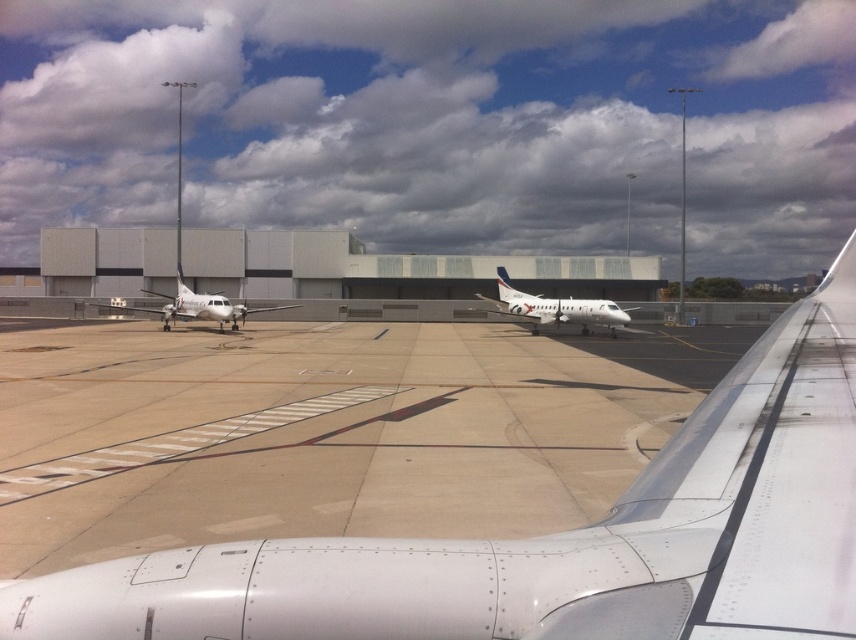
You are a ground crew member observing the two airplanes at the airport. Which airplane, the white metallic airplane at center or the silver metallic airplane at center, is positioned lower on the tarmac?

The white metallic airplane at center is located below the silver metallic airplane at center, so it is positioned lower on the tarmac.

You are a pilot preparing to taxi your plane on the airport tarmac. You see the silver metallic airplane at center and the white matte airplane at left. Which airplane is directly above the other?

The silver metallic airplane at center is positioned under the white matte airplane at left, meaning the white matte airplane at left is directly above the silver metallic airplane at center.